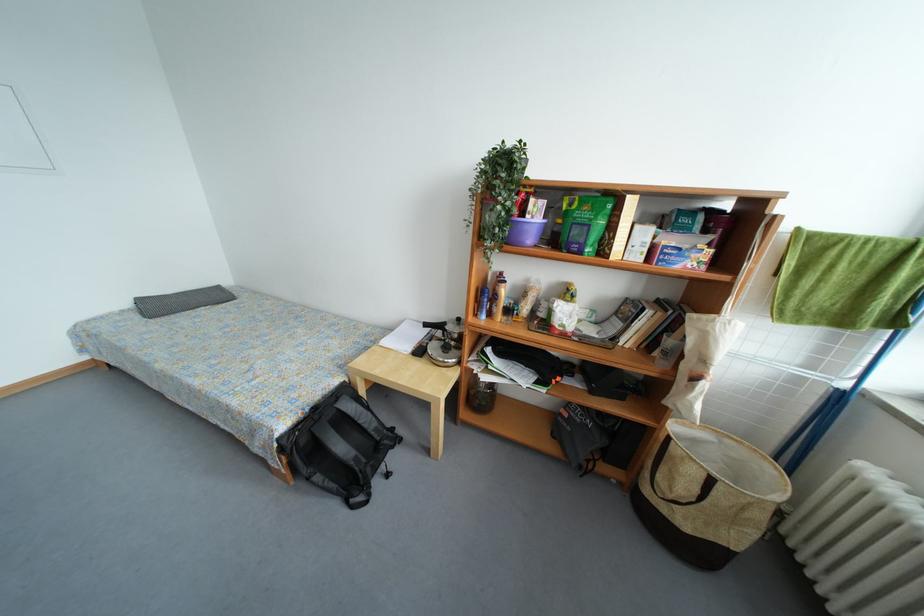
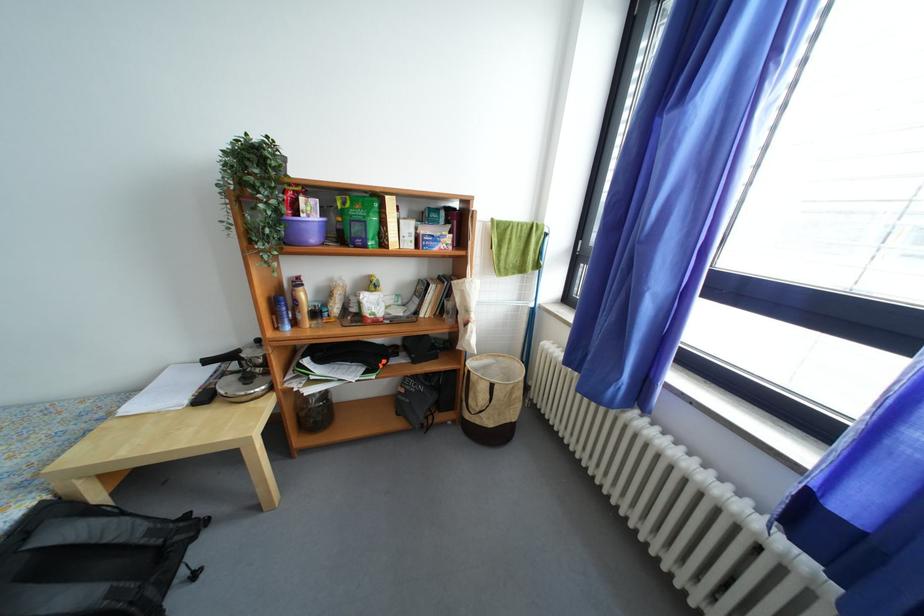
The point at (379, 344) is marked in the first image. Where is the corresponding point in the second image?

(106, 419)